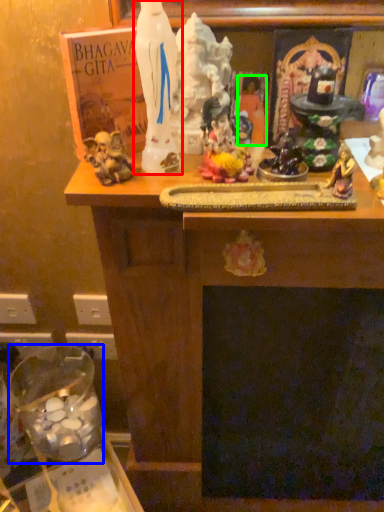
Question: Which is farther away from statue (highlighted by a red box)? glass jar (highlighted by a blue box) or person (highlighted by a green box)?

Choices:
 (A) glass jar
 (B) person

Answer: (A)